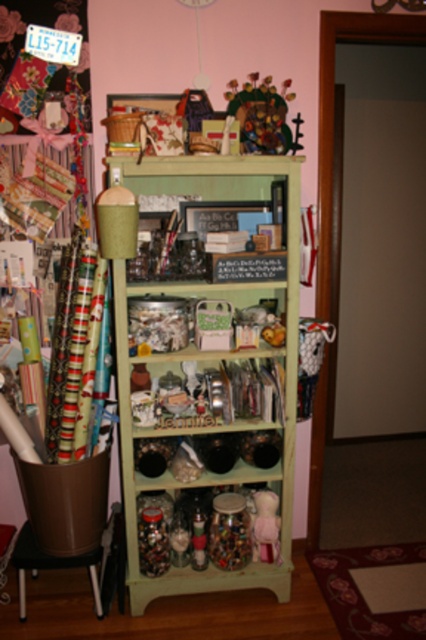
Based on the photo, you are organizing the craft area and need to move the brown plastic stool at lower left closer to the green painted wood bookshelf at center. Which direction should you move the stool?

You should move the brown plastic stool at lower left to the right to place it closer to the green painted wood bookshelf at center since the bookshelf is currently to the right of the stool.

You are standing in the craft area and need to locate the green painted wood bookshelf at center. Based on the coordinates provided, where would you find it?

The green painted wood bookshelf at center is located at coordinates point (210, 380).

You are organizing a space and need to place a 1.2 meter tall plant stand. The green painted wood bookshelf at center and the brown plastic stool at lower left are in the way. Which object should you move to make space for the plant stand?

The green painted wood bookshelf at center is taller than the brown plastic stool at lower left, so you should move the brown plastic stool at lower left to make space for the plant stand since it is shorter and easier to relocate.